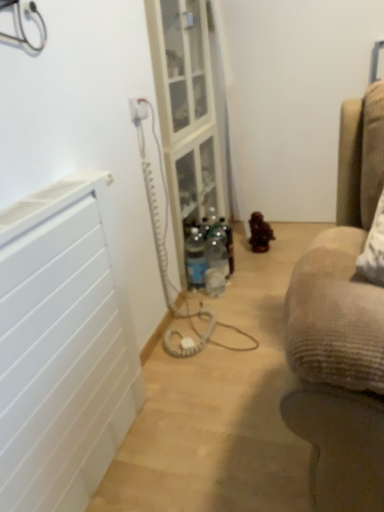
Measure the distance between point (215, 194) and camera.

The depth of point (215, 194) is 8.94 feet.

This screenshot has width=384, height=512. Describe the element at coordinates (138, 110) in the screenshot. I see `white plastic electric outlet at upper center` at that location.

You are a GUI agent. You are given a task and a screenshot of the screen. Output one action in this format:
    pyautogui.click(x=<x>, y=<y>)
    Task: Click on the white plastic electric outlet at upper center
    
    Given the screenshot: What is the action you would take?
    pyautogui.click(x=138, y=110)

Describe the element at coordinates (195, 258) in the screenshot. Image resolution: width=384 pixels, height=512 pixels. I see `clear plastic bottle at center` at that location.

In order to face clear plastic bottle at center, should I rotate leftwards or rightwards?

Rotate your view right by about 0.799°.

At what (x,y) coordinates should I click in order to perform the action: click on clear glass shelf at center. Please return your answer as a coordinate pair (x, y). Looking at the image, I should click on (193, 187).

In the scene shown: Which of these two, clear plastic bottle at center or white plastic electric outlet at upper center, stands taller?

clear plastic bottle at center is taller.

Is clear plastic bottle at center far from white plastic electric outlet at upper center?

No, clear plastic bottle at center is in close proximity to white plastic electric outlet at upper center.

Is clear plastic bottle at center further to the viewer compared to white plastic electric outlet at upper center?

Yes, it is.

Is white matte radiator at left in front of or behind white plastic electric outlet at upper center in the image?

white matte radiator at left is positioned closer to the viewer than white plastic electric outlet at upper center.

Does white matte radiator at left contain white plastic electric outlet at upper center?

Actually, white plastic electric outlet at upper center is outside white matte radiator at left.

Could you tell me if white matte radiator at left is facing white plastic electric outlet at upper center?

No, white matte radiator at left does not turn towards white plastic electric outlet at upper center.

From a real-world perspective, between white matte radiator at left and white plastic electric outlet at upper center, who is vertically higher?

white plastic electric outlet at upper center.

Would you consider clear glass shelf at center to be distant from white plastic electric outlet at upper center?

clear glass shelf at center is actually quite close to white plastic electric outlet at upper center.

Is clear glass shelf at center smaller than white plastic electric outlet at upper center?

No, clear glass shelf at center is not smaller than white plastic electric outlet at upper center.

From a real-world perspective, does clear glass shelf at center sit lower than white plastic electric outlet at upper center?

Yes, from a real-world perspective, clear glass shelf at center is beneath white plastic electric outlet at upper center.

From a real-world perspective, is clear plastic bottle at center above or below white matte radiator at left?

Clearly, from a real-world perspective, clear plastic bottle at center is below white matte radiator at left.

In the image, is clear plastic bottle at center positioned in front of or behind white matte radiator at left?

Visually, clear plastic bottle at center is located behind white matte radiator at left.

Considering the sizes of clear plastic bottle at center and white matte radiator at left in the image, is clear plastic bottle at center taller or shorter than white matte radiator at left?

Considering their sizes, clear plastic bottle at center has less height than white matte radiator at left.

Which object is positioned more to the right, clear plastic bottle at center or white matte radiator at left?

Positioned to the right is clear plastic bottle at center.

Between white plastic electric outlet at upper center and white matte radiator at left, which one is positioned behind?

white plastic electric outlet at upper center is more distant.

Between white plastic electric outlet at upper center and white matte radiator at left, which one has larger size?

white matte radiator at left.

The width and height of the screenshot is (384, 512). I want to click on radiator in front of the white plastic electric outlet at upper center, so click(62, 347).

Is white plastic electric outlet at upper center not close to white matte radiator at left?

Actually, white plastic electric outlet at upper center and white matte radiator at left are a little close together.

From a real-world perspective, who is located higher, white matte radiator at left or clear glass shelf at center?

From a 3D spatial view, white matte radiator at left is above.

Does white matte radiator at left have a greater height compared to clear glass shelf at center?

Indeed, white matte radiator at left has a greater height compared to clear glass shelf at center.

Considering the sizes of objects white matte radiator at left and clear glass shelf at center in the image provided, who is wider, white matte radiator at left or clear glass shelf at center?

With larger width is clear glass shelf at center.

Is clear glass shelf at center looking in the opposite direction of white matte radiator at left?

No, clear glass shelf at center is not facing the opposite direction of white matte radiator at left.

Between point (203, 189) and point (86, 478), which one is positioned behind?

Positioned behind is point (203, 189).

From the picture: Is the depth of clear glass shelf at center greater than that of white matte radiator at left?

Yes, clear glass shelf at center is further from the camera.

Does clear glass shelf at center appear on the right side of white matte radiator at left?

Yes.

At what (x,y) coordinates should I click in order to perform the action: click on bottle on the right of the white plastic electric outlet at upper center. Please return your answer as a coordinate pair (x, y). The image size is (384, 512). Looking at the image, I should click on (195, 258).

Locate an element on the screen. The height and width of the screenshot is (512, 384). radiator on the left of white plastic electric outlet at upper center is located at coordinates (62, 347).

Considering their positions, is clear plastic bottle at center positioned closer to white plastic electric outlet at upper center than clear glass shelf at center?

clear glass shelf at center lies closer to white plastic electric outlet at upper center than the other object.

From the image, which object appears to be nearer to clear plastic bottle at center, clear glass shelf at center or white plastic electric outlet at upper center?

The object closer to clear plastic bottle at center is clear glass shelf at center.

From the image, which object appears to be farther from white plastic electric outlet at upper center, clear plastic bottle at center or white matte radiator at left?

white matte radiator at left.

Looking at the image, which one is located closer to white matte radiator at left, clear glass shelf at center or white plastic electric outlet at upper center?

white plastic electric outlet at upper center.

Estimate the real-world distances between objects in this image. Which object is further from white plastic electric outlet at upper center, clear glass shelf at center or white matte radiator at left?

white matte radiator at left is further to white plastic electric outlet at upper center.

Looking at the image, which one is located further to white plastic electric outlet at upper center, white matte radiator at left or clear glass shelf at center?

white matte radiator at left is positioned further to the anchor white plastic electric outlet at upper center.

When comparing their distances from clear glass shelf at center, does white matte radiator at left or white plastic electric outlet at upper center seem closer?

white plastic electric outlet at upper center is positioned closer to the anchor clear glass shelf at center.

When comparing their distances from white matte radiator at left, does clear plastic bottle at center or clear glass shelf at center seem closer?

clear plastic bottle at center lies closer to white matte radiator at left than the other object.

Find the location of a particular element. The width and height of the screenshot is (384, 512). shelf between white matte radiator at left and clear plastic bottle at center from front to back is located at coordinates (193, 187).

Where is `electric outlet located between white matte radiator at left and clear glass shelf at center in the depth direction`? electric outlet located between white matte radiator at left and clear glass shelf at center in the depth direction is located at coordinates (138, 110).

Find the location of a particular element. This screenshot has height=512, width=384. shelf that lies between white plastic electric outlet at upper center and clear plastic bottle at center from top to bottom is located at coordinates (193, 187).

You are a GUI agent. You are given a task and a screenshot of the screen. Output one action in this format:
    pyautogui.click(x=<x>, y=<y>)
    Task: Click on the electric outlet between white matte radiator at left and clear plastic bottle at center in the front-back direction
    The height and width of the screenshot is (512, 384).
    Given the screenshot: What is the action you would take?
    pyautogui.click(x=138, y=110)